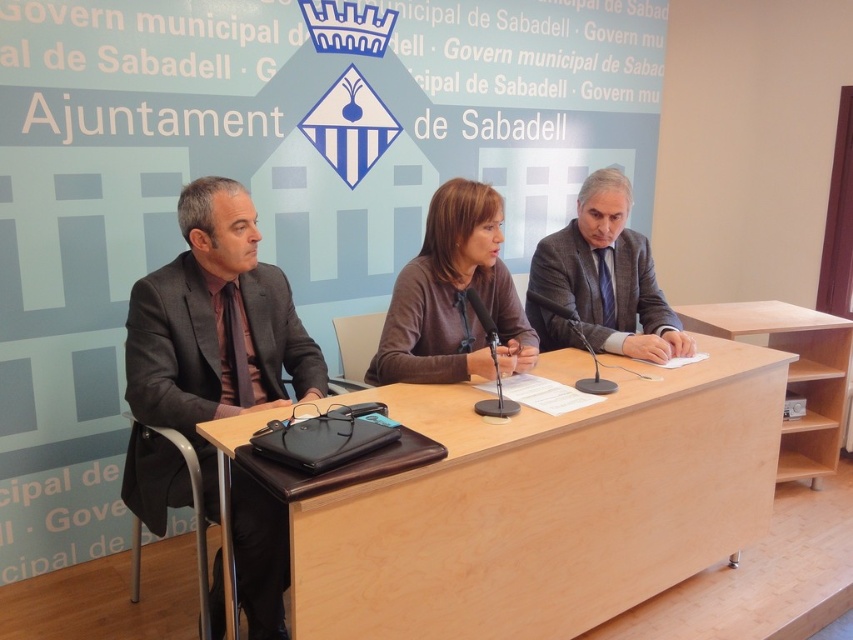
Which is more to the right, light brown wood table at center or dark gray suit at center?

light brown wood table at center

Which is behind, point (669, 580) or point (218, 228)?

The point (669, 580) is behind.

Is point (431, 570) positioned in front of point (242, 474)?

Yes, point (431, 570) is closer to viewer.

At what (x,y) coordinates should I click in order to perform the action: click on light brown wood table at center. Please return your answer as a coordinate pair (x, y). The image size is (853, 640). Looking at the image, I should click on (544, 506).

In the scene shown: Who is more forward, (647, 520) or (589, 308)?

Point (647, 520)

Does light brown wood table at center appear under dark gray wool suit at right?

Yes, light brown wood table at center is below dark gray wool suit at right.

Between point (410, 556) and point (634, 273), which one is positioned behind?

The point (634, 273) is more distant.

The width and height of the screenshot is (853, 640). Identify the location of light brown wood table at center. (544, 506).

Can you confirm if brown matte sweater at center is positioned above dark gray wool suit at right?

No, brown matte sweater at center is not above dark gray wool suit at right.

Is brown matte sweater at center bigger than dark gray wool suit at right?

Indeed, brown matte sweater at center has a larger size compared to dark gray wool suit at right.

Between point (404, 340) and point (637, 273), which one is positioned behind?

The point (637, 273) is behind.

Where is `brown matte sweater at center`? brown matte sweater at center is located at coordinates (453, 298).